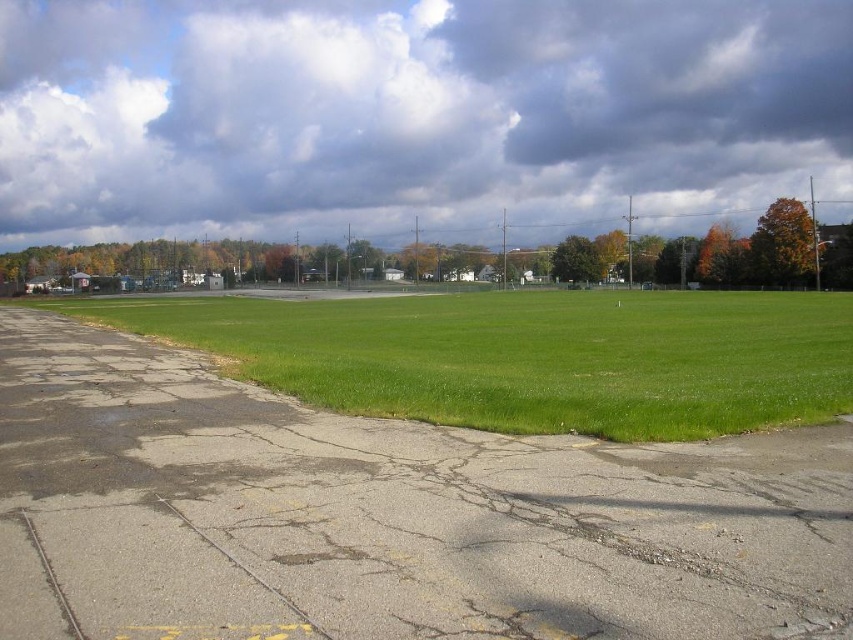
Question: Is cloudy sky at upper wider than green grass at center?

Choices:
 (A) no
 (B) yes

Answer: (B)

Question: Which object appears closest to the camera in this image?

Choices:
 (A) cloudy sky at upper
 (B) green grass at center

Answer: (B)

Question: Does cloudy sky at upper appear on the right side of green grass at center?

Choices:
 (A) no
 (B) yes

Answer: (A)

Question: Which point appears closest to the camera in this image?

Choices:
 (A) (572, 314)
 (B) (753, 163)

Answer: (A)

Question: Can you confirm if cloudy sky at upper is positioned below green grass at center?

Choices:
 (A) no
 (B) yes

Answer: (A)

Question: Which object appears closest to the camera in this image?

Choices:
 (A) cloudy sky at upper
 (B) green grass at center

Answer: (B)